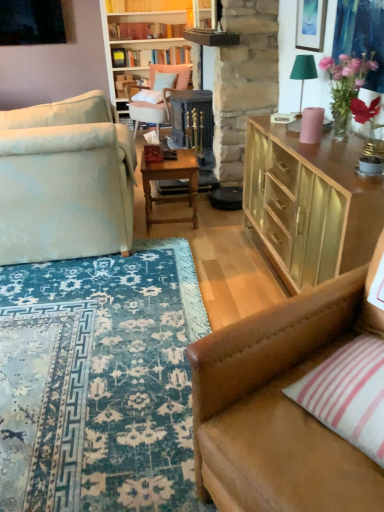
Identify the location of free space above wooden table at center (from a real-world perspective). (164, 158).